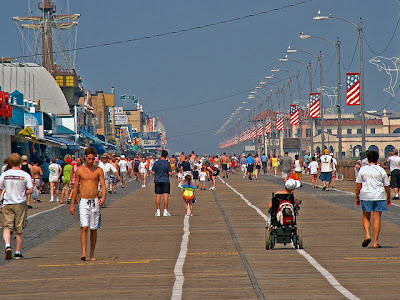
Where is `wheel chair`? This screenshot has width=400, height=300. wheel chair is located at coordinates pos(284,230).